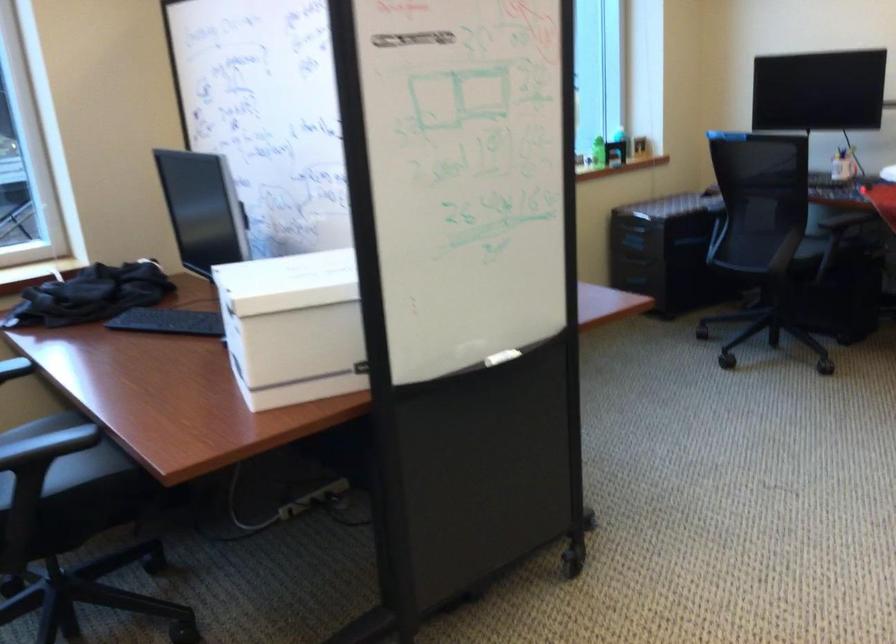
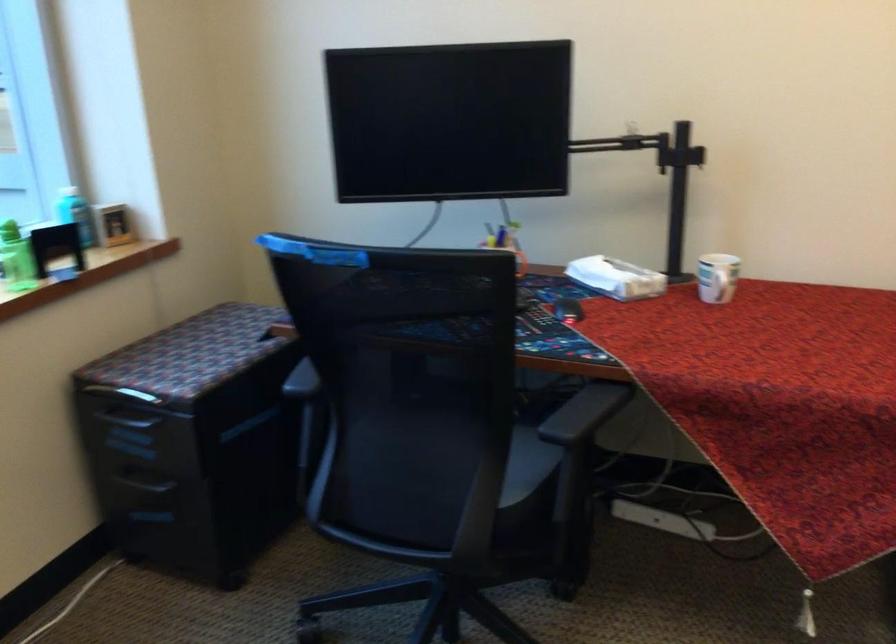
Where in the second image is the point corresponding to the point at 636,205 from the first image?

(125, 393)